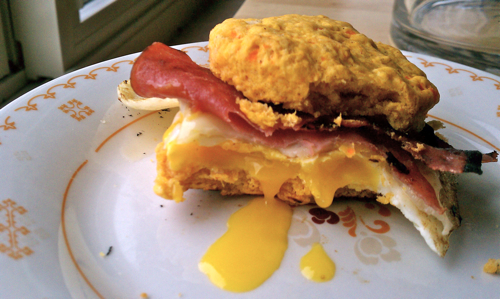
This screenshot has width=500, height=299. I want to click on crumb, so click(x=492, y=267).